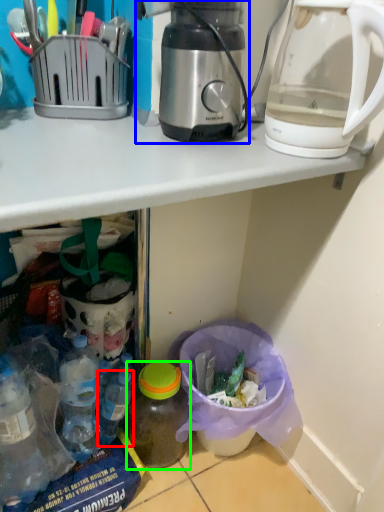
Question: Which object is positioned farthest from bottle (highlighted by a red box)? Select from coffee maker (highlighted by a blue box) and bottle (highlighted by a green box).

Choices:
 (A) coffee maker
 (B) bottle

Answer: (A)